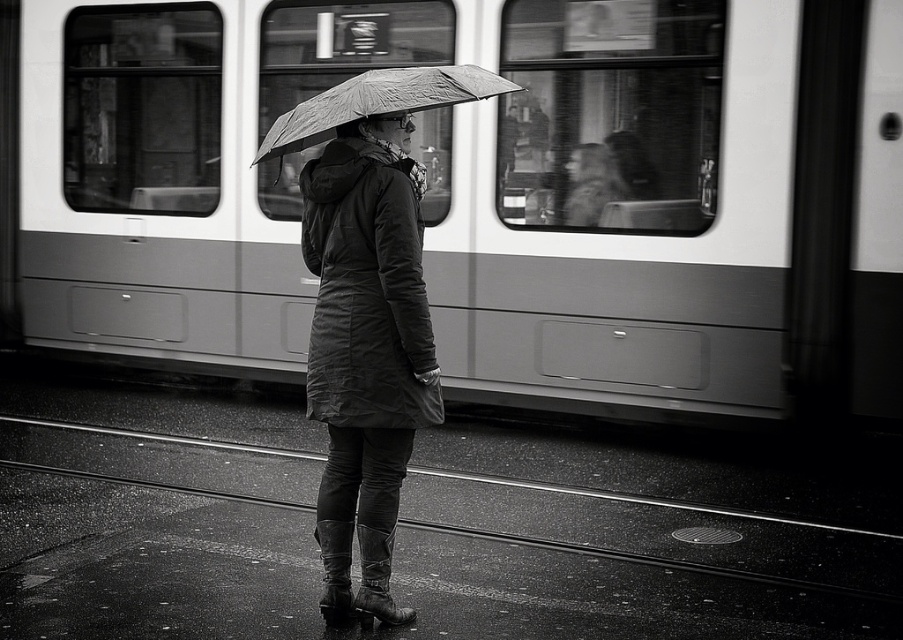
Is point (270, 372) closer to camera compared to point (303, 112)?

That is False.

Is point (470, 292) positioned behind point (258, 156)?

That is True.

This screenshot has height=640, width=903. Identify the location of smooth metal train at center. (479, 192).

Who is higher up, smooth metal train at center or matte black coat at center?

smooth metal train at center is above.

Does point (1, 90) come closer to viewer compared to point (399, 452)?

That is False.

Is point (489, 164) behind point (371, 541)?

That is True.

Where is `smooth metal train at center`? The image size is (903, 640). smooth metal train at center is located at coordinates (479, 192).

Does matte black coat at center appear on the right side of textured fabric umbrella at center?

In fact, matte black coat at center is to the left of textured fabric umbrella at center.

Locate an element on the screen. This screenshot has height=640, width=903. matte black coat at center is located at coordinates (365, 349).